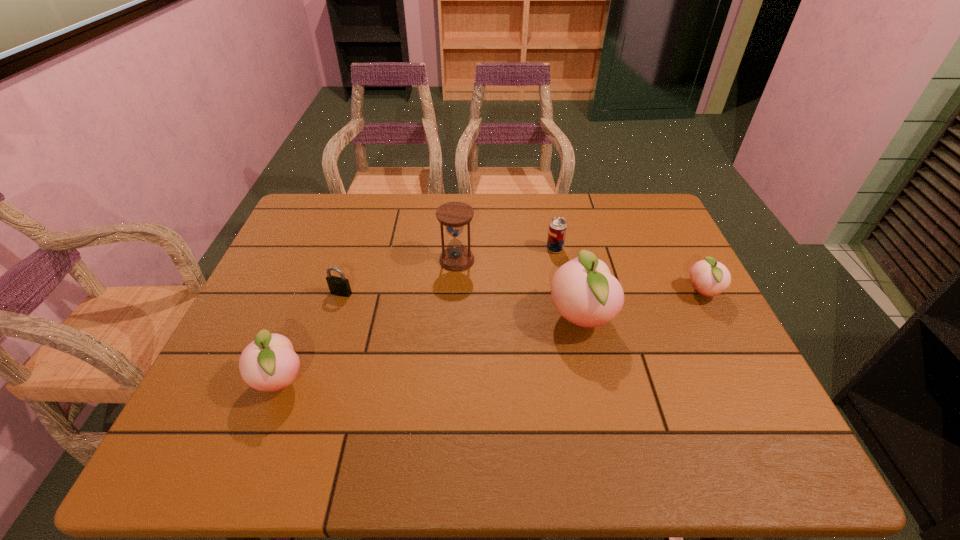
The width and height of the screenshot is (960, 540). What are the coordinates of `the fourth shortest object` in the screenshot? It's located at (269, 363).

Image resolution: width=960 pixels, height=540 pixels. What are the coordinates of `the nearest object` in the screenshot? It's located at (269, 363).

The image size is (960, 540). In order to click on the second peach from right to left in this screenshot , I will do `click(584, 292)`.

Locate an element on the screen. the rightmost object is located at coordinates (710, 278).

You are a GUI agent. You are given a task and a screenshot of the screen. Output one action in this format:
    pyautogui.click(x=<x>, y=<y>)
    Task: Click on the rightmost peach
    
    Given the screenshot: What is the action you would take?
    pyautogui.click(x=710, y=278)

At what (x,y) coordinates should I click in order to perform the action: click on beer can. Please return your answer as a coordinate pair (x, y). This screenshot has width=960, height=540. Looking at the image, I should click on (557, 228).

Locate an element on the screen. the third object from left to right is located at coordinates (454, 216).

Locate an element on the screen. the fifth shortest object is located at coordinates (454, 216).

This screenshot has height=540, width=960. What are the coordinates of `padlock` in the screenshot? It's located at (339, 286).

Where is `vacant region located 0.210m on the right of the nearest peach`? Image resolution: width=960 pixels, height=540 pixels. vacant region located 0.210m on the right of the nearest peach is located at coordinates click(x=403, y=381).